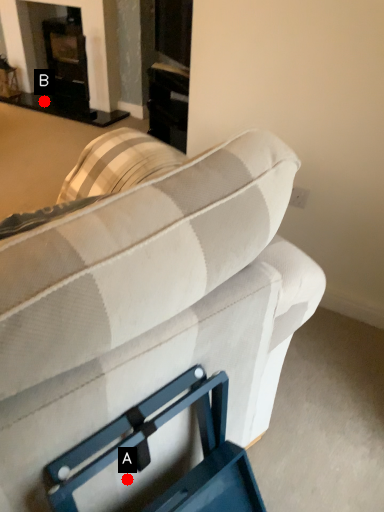
Question: Two points are circled on the image, labeled by A and B beside each circle. Which point appears farthest from the camera in this image?

Choices:
 (A) A is further
 (B) B is further

Answer: (B)